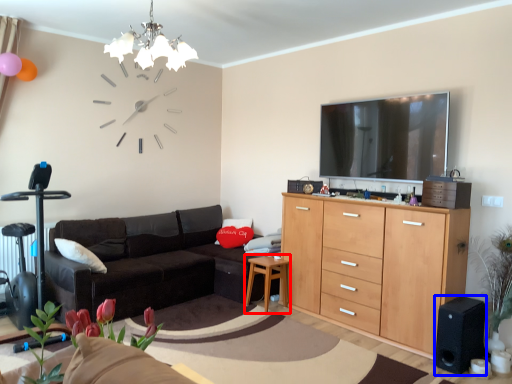
Question: Which object is further to the camera taking this photo, side table (highlighted by a red box) or speaker (highlighted by a blue box)?

Choices:
 (A) side table
 (B) speaker

Answer: (A)